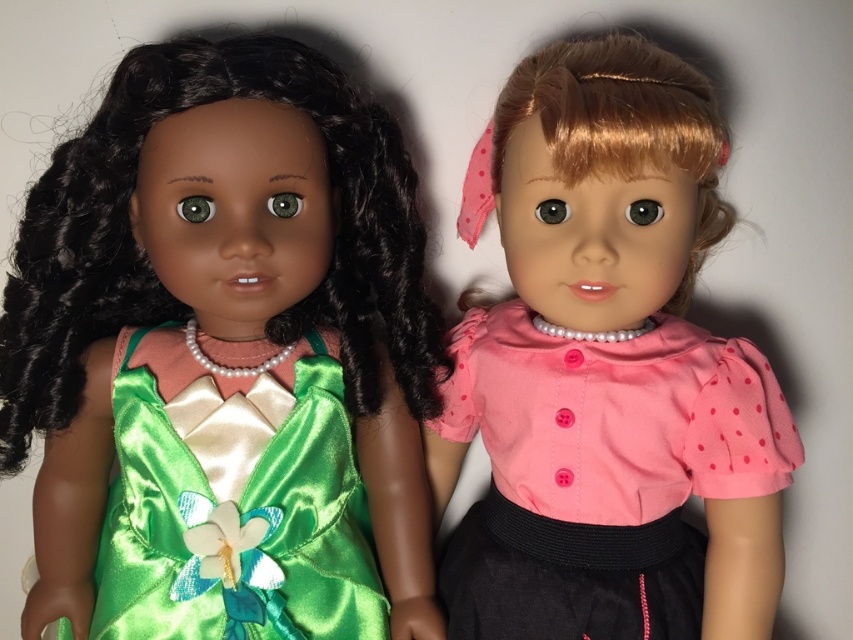
You are a toy organizer who needs to place two green satin dresses in a display case. The display case has a shelf that is 2 inches wide. If you place the green satin dress at left and the green satin dress at center on the shelf, will they fit side by side?

The green satin dress at left and green satin dress at center are 1.79 inches apart, so they will fit side by side on the 2 inch wide shelf since the total width required is less than the shelf width.